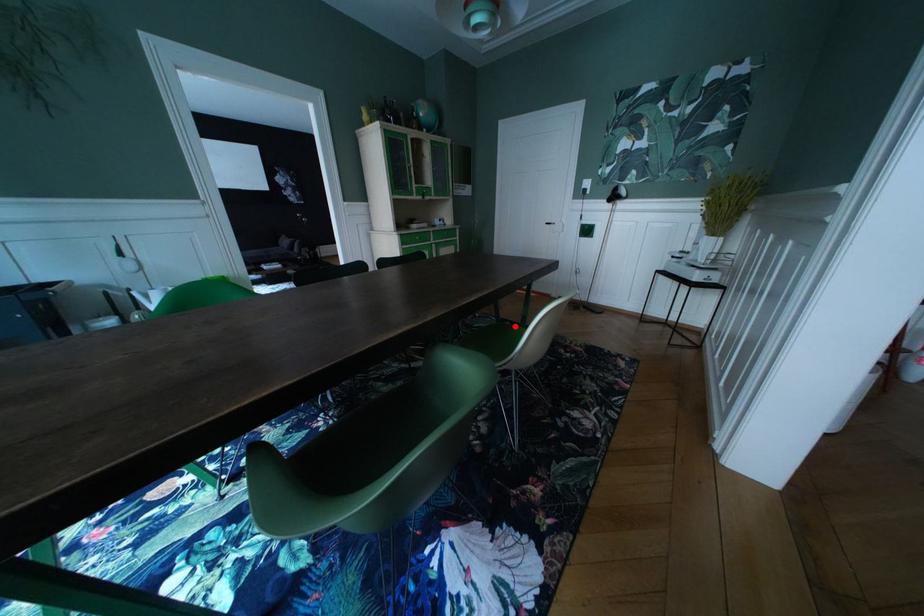
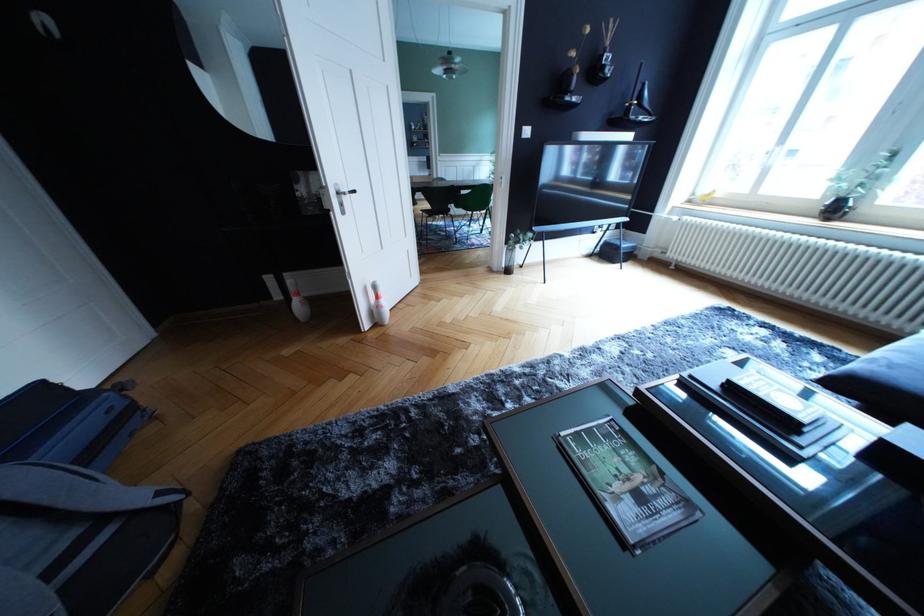
Question: I am providing you with two images of the same scene from different viewpoints. A red point is marked on the first image. At the location where the point appears in image 1, is it still visible in image 2?

Choices:
 (A) Yes
 (B) No

Answer: (B)